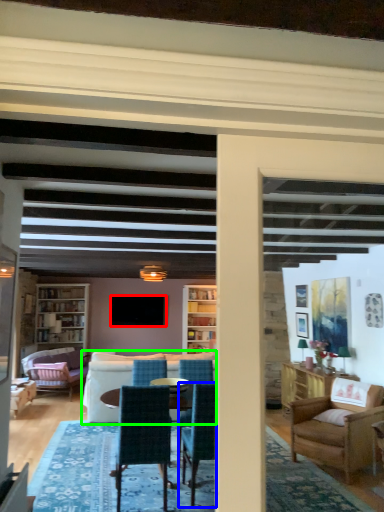
Question: Which object is the closest to the television (highlighted by a red box)? Choose among these: chair (highlighted by a blue box) or studio couch (highlighted by a green box).

Choices:
 (A) chair
 (B) studio couch

Answer: (B)